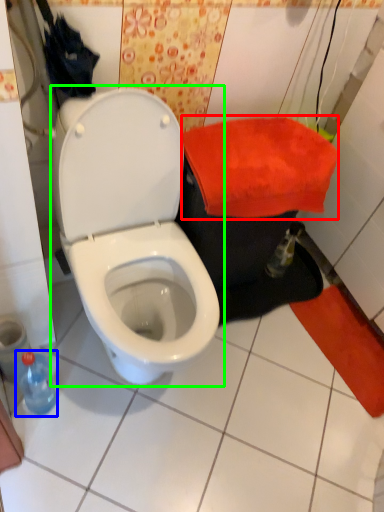
Question: Which object is the closest to the beach towel (highlighted by a red box)? Choose among these: bottle (highlighted by a blue box) or toilet (highlighted by a green box).

Choices:
 (A) bottle
 (B) toilet

Answer: (B)